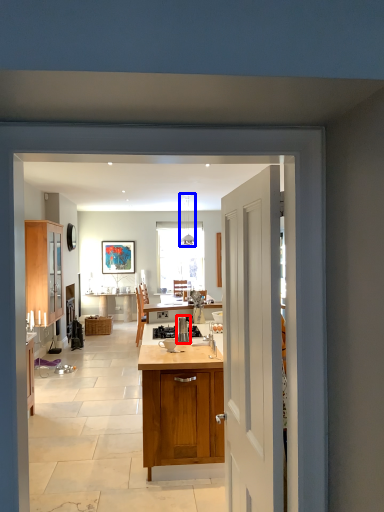
Question: Which point is closer to the camera, kitchen appliance (highlighted by a red box) or lamp (highlighted by a blue box)?

Choices:
 (A) kitchen appliance
 (B) lamp

Answer: (A)